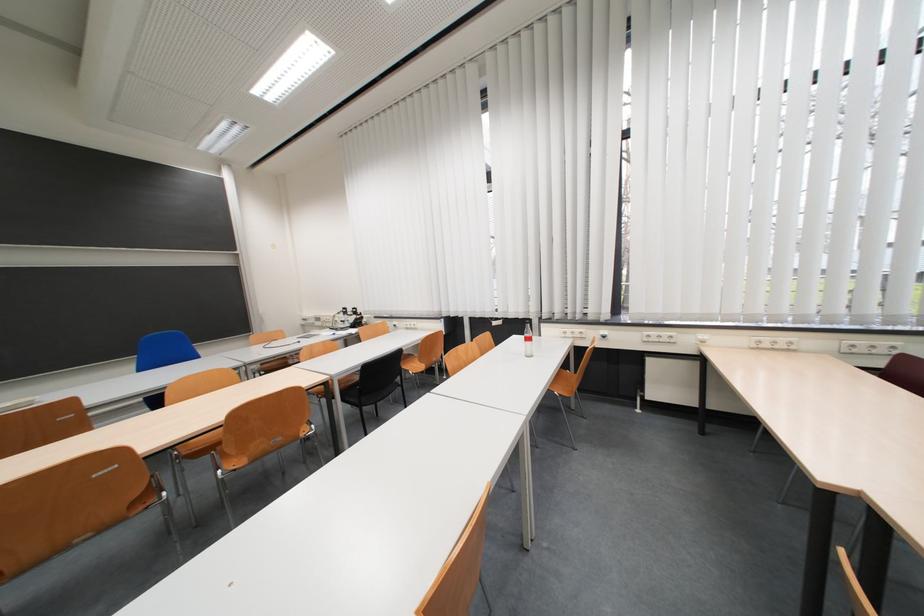
Locate an element on the screen. microscope focus knob is located at coordinates (347, 318).